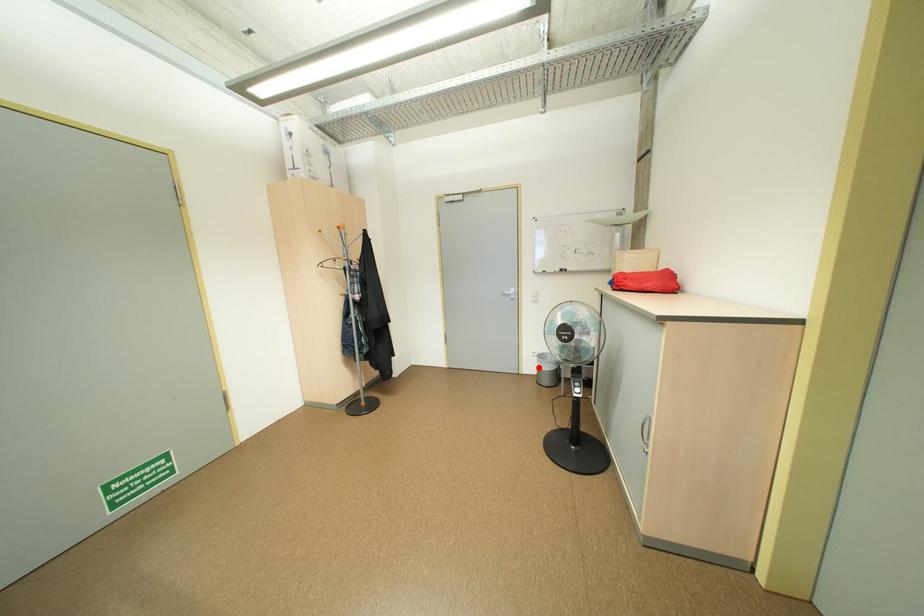
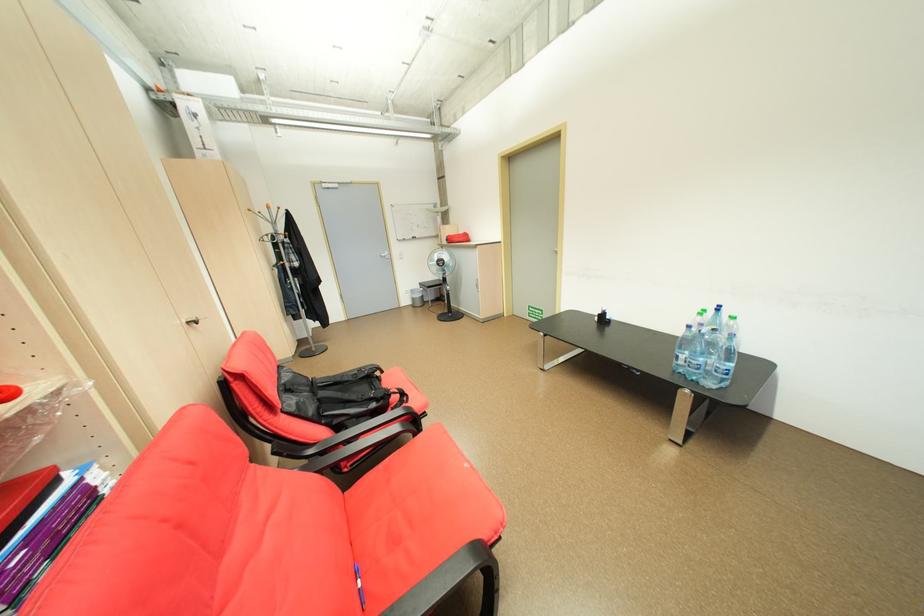
In the second image, find the point that corresponds to the highlighted location in the first image.

(415, 302)